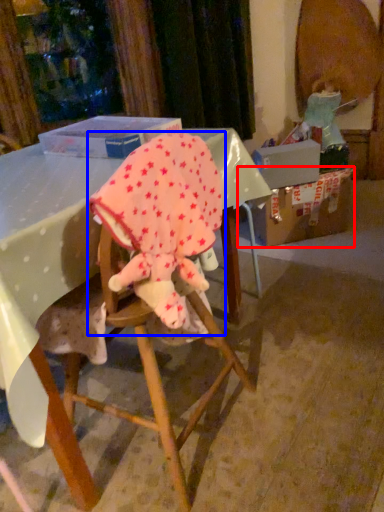
Question: Among these objects, which one is farthest to the camera, cardboard box (highlighted by a red box) or baby elephant (highlighted by a blue box)?

Choices:
 (A) cardboard box
 (B) baby elephant

Answer: (A)